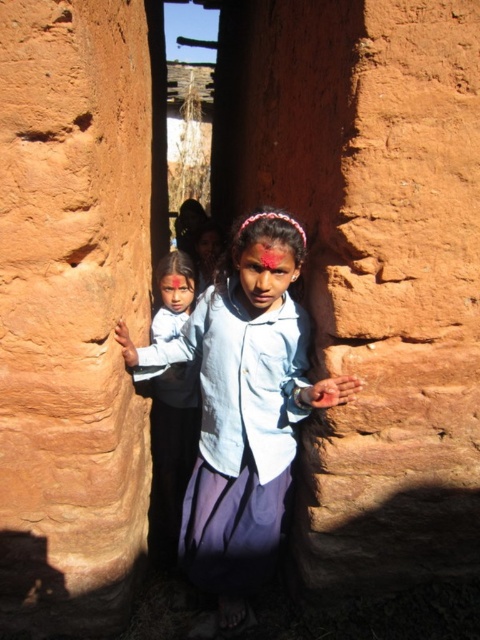
Who is lower down, matte clay wall at center or matte blue shirt at center?

matte blue shirt at center

Based on the photo, can you confirm if matte clay wall at center is wider than matte blue shirt at center?

Indeed, matte clay wall at center has a greater width compared to matte blue shirt at center.

At what (x,y) coordinates should I click in order to perform the action: click on matte clay wall at center. Please return your answer as a coordinate pair (x, y). This screenshot has width=480, height=640. Looking at the image, I should click on (72, 310).

Is light blue denim shirt at center to the left of matte blue shirt at center from the viewer's perspective?

Incorrect, light blue denim shirt at center is not on the left side of matte blue shirt at center.

Does point (278, 324) lie in front of point (169, 385)?

Yes, it is in front of point (169, 385).

Is point (287, 230) in front of point (178, 269)?

Yes, it is.

Locate an element on the screen. Image resolution: width=480 pixels, height=640 pixels. light blue denim shirt at center is located at coordinates (243, 408).

Who is positioned more to the left, matte clay wall at center or light blue denim shirt at center?

matte clay wall at center

Does point (118, 465) come in front of point (136, 355)?

Yes.

Is point (86, 621) positioned before point (247, 563)?

Yes, it is.

Locate an element on the screen. The height and width of the screenshot is (640, 480). matte clay wall at center is located at coordinates (72, 310).